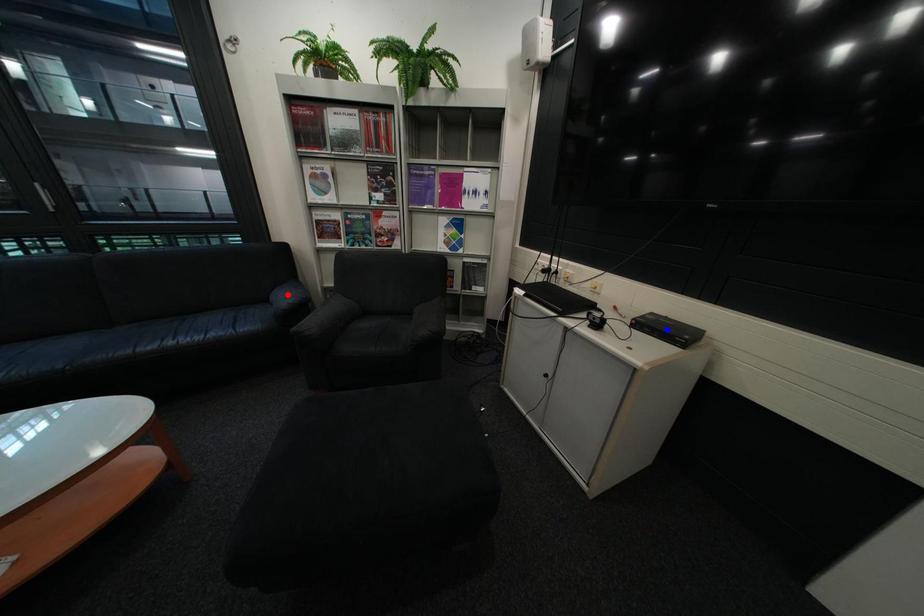
Question: Two points are marked on the image. Which point is closer to the camera?

Choices:
 (A) Blue point is closer.
 (B) Red point is closer.

Answer: (A)